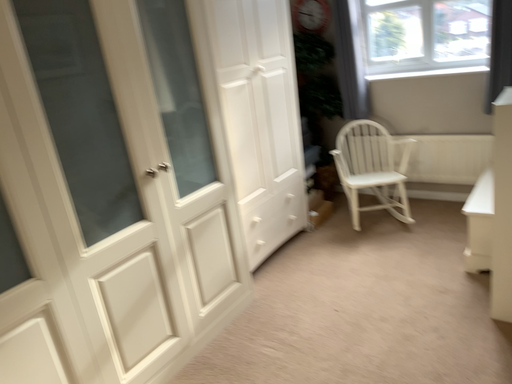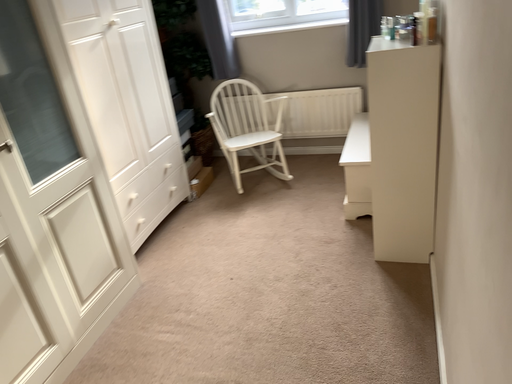
Question: How did the camera likely rotate when shooting the video?

Choices:
 (A) rotated right
 (B) rotated left

Answer: (A)